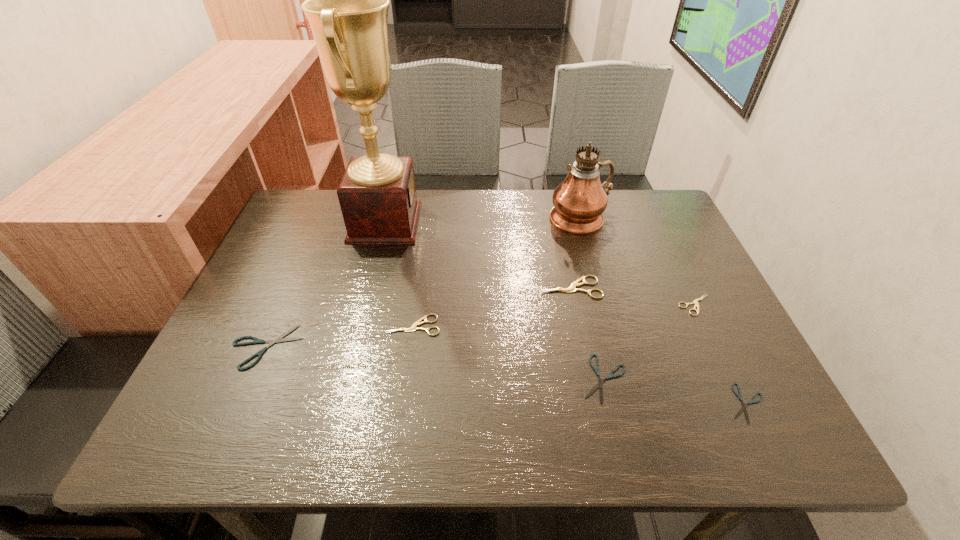
This screenshot has width=960, height=540. Identify the location of trophy cup. (347, 0).

Where is `oil lamp`? This screenshot has width=960, height=540. oil lamp is located at coordinates (579, 201).

At what (x,y) coordinates should I click in order to perform the action: click on the tallest shears. Please return your answer as a coordinate pair (x, y). Looking at the image, I should click on (571, 289).

Where is `the sixth shortest object`? The width and height of the screenshot is (960, 540). the sixth shortest object is located at coordinates (571, 289).

Identify the location of the second tallest shears. (414, 327).

Locate an element on the screen. Image resolution: width=960 pixels, height=540 pixels. the leftmost beige shears is located at coordinates (414, 327).

Image resolution: width=960 pixels, height=540 pixels. In order to click on the leftmost shears in this screenshot , I will do `click(256, 341)`.

Locate an element on the screen. the leftmost black shears is located at coordinates (256, 341).

I want to click on the rightmost beige shears, so click(695, 301).

Where is `the second smallest black shears`? This screenshot has width=960, height=540. the second smallest black shears is located at coordinates click(600, 382).